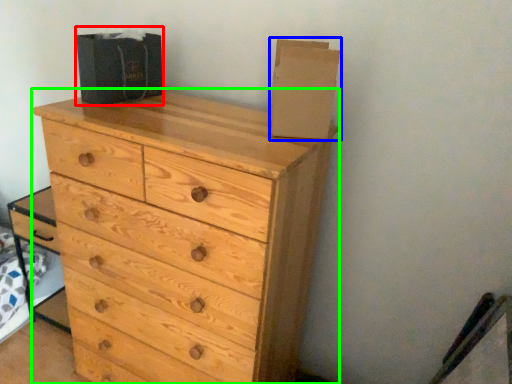
Question: Which object is positioned farthest from cardboard box (highlighted by a red box)? Select from cardboard box (highlighted by a blue box) and chest of drawers (highlighted by a green box).

Choices:
 (A) cardboard box
 (B) chest of drawers

Answer: (A)